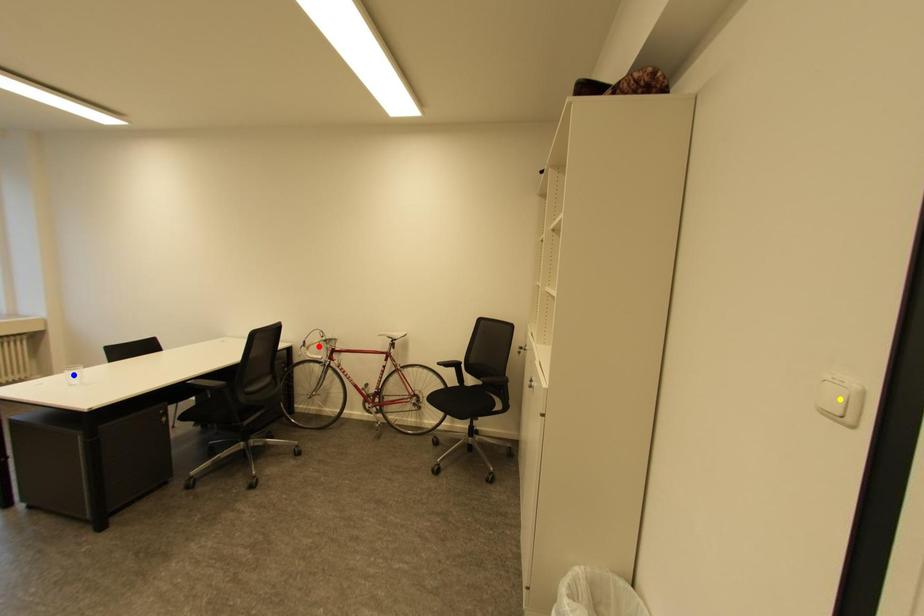
Order these from farthest to nearest:
1. blue point
2. yellow point
3. red point

red point → blue point → yellow point